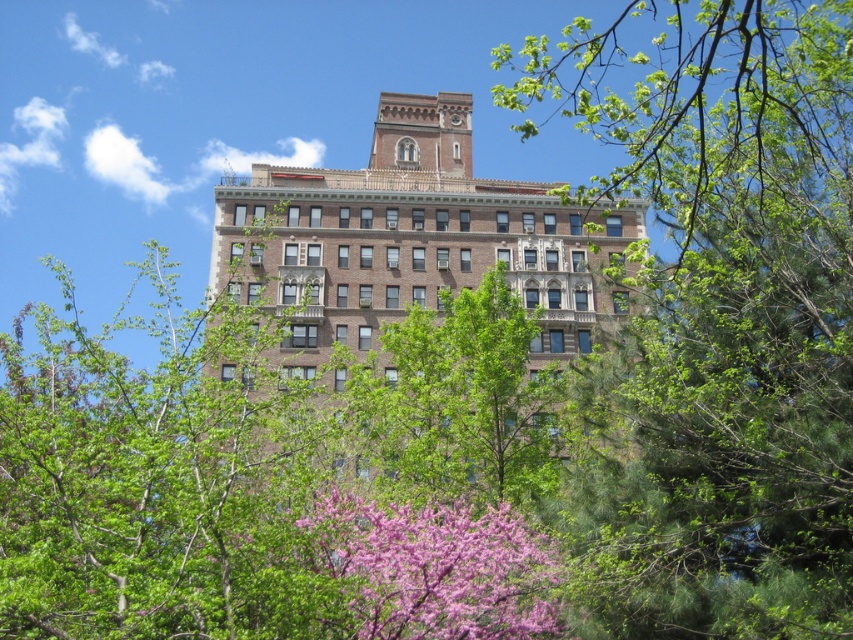
You are an architect analyzing the building and its surroundings. You notice the green leafy tree at upper center and the brown brick building at center. Which of these two has a smaller width when viewed from your perspective?

The green leafy tree at upper center has a lesser width compared to the brown brick building at center, so the green leafy tree at upper center is narrower.

You are standing in front of the brown brick building at center and want to take a photo of the green leafy tree at upper center. Considering their heights, will the tree be fully visible in the photo without any part being cut off by the building?

The green leafy tree at upper center is taller than the brown brick building at center, so the tree will be fully visible in the photo without any part being cut off by the building.

You are standing in front of the building and notice two points marked on the facade. The first point is at coordinate point (x=614, y=518) and the second is at point (x=553, y=268). Which point is nearer to you?

Point (x=614, y=518) is closer to the camera than point (x=553, y=268), so the first point is nearer to you.